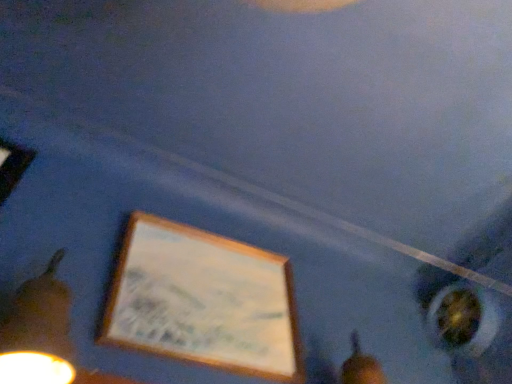
Identify the location of wooden picture frame at lower center. pyautogui.click(x=203, y=301).

What do you see at coordinates (203, 301) in the screenshot? Image resolution: width=512 pixels, height=384 pixels. I see `wooden picture frame at lower center` at bounding box center [203, 301].

I want to click on wooden picture frame at lower center, so click(x=203, y=301).